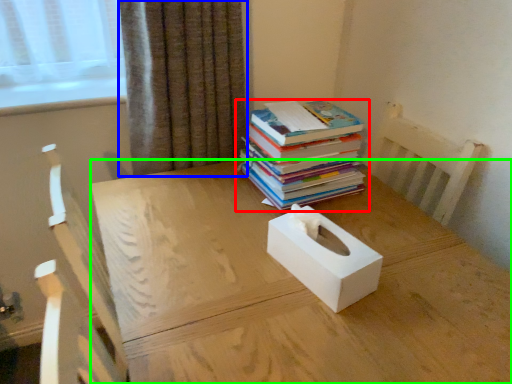
Question: Considering the real-world distances, which object is farthest from book (highlighted by a red box)? curtain (highlighted by a blue box) or desk (highlighted by a green box)?

Choices:
 (A) curtain
 (B) desk

Answer: (A)